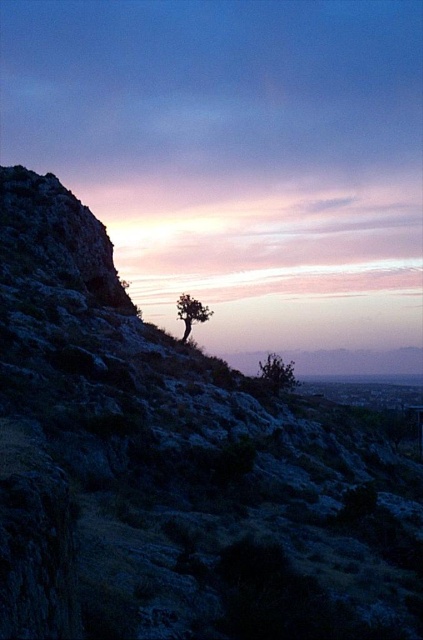
Which is above, green textured hillside at center or green leafy shrub at center?

green textured hillside at center is higher up.

Is green textured hillside at center wider than green leafy shrub at center?

Indeed, green textured hillside at center has a greater width compared to green leafy shrub at center.

Measure the distance between point (175, 532) and camera.

Point (175, 532) and camera are 17.45 meters apart from each other.

Find the location of a particular element. green textured hillside at center is located at coordinates (173, 468).

Can you confirm if green leafy shrub at center is positioned to the left of green matte tree at center?

Incorrect, green leafy shrub at center is not on the left side of green matte tree at center.

Between green leafy shrub at center and green matte tree at center, which one is positioned higher?

green matte tree at center

Where is `green leafy shrub at center`? green leafy shrub at center is located at coordinates (277, 372).

Where is `green textured hillside at center`? green textured hillside at center is located at coordinates (173, 468).

Is point (132, 384) positioned behind point (180, 298)?

That is False.

You are a GUI agent. You are given a task and a screenshot of the screen. Output one action in this format:
    pyautogui.click(x=<x>, y=<y>)
    Task: Click on the green textured hillside at center
    Image resolution: width=423 pixels, height=640 pixels.
    Given the screenshot: What is the action you would take?
    pyautogui.click(x=173, y=468)

At what (x,y) coordinates should I click in order to perform the action: click on green textured hillside at center. Please return your answer as a coordinate pair (x, y). This screenshot has height=640, width=423. Looking at the image, I should click on (173, 468).